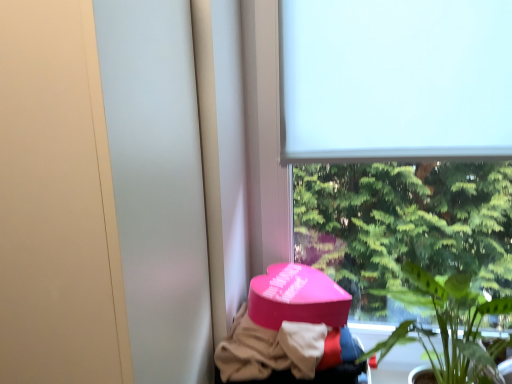
Question: In terms of width, does pink matte heart-shaped box at lower center look wider or thinner when compared to white matte window at upper center?

Choices:
 (A) thin
 (B) wide

Answer: (B)

Question: Is pink matte heart-shaped box at lower center in front of or behind white matte window at upper center in the image?

Choices:
 (A) front
 (B) behind

Answer: (A)

Question: Which of these objects is positioned farthest from the white matte window screen at upper center?

Choices:
 (A) pink matte heart-shaped box at lower center
 (B) green leafy plant at lower right
 (C) white matte window at upper center

Answer: (A)

Question: Based on their relative distances, which object is nearer to the white matte window at upper center?

Choices:
 (A) white matte window screen at upper center
 (B) pink matte heart-shaped box at lower center
 (C) green leafy plant at lower right

Answer: (A)